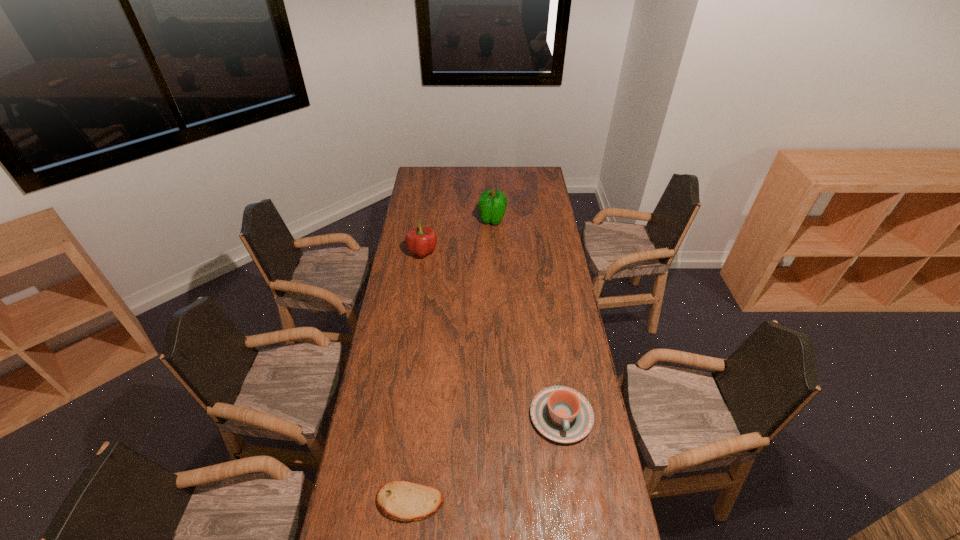
You are a GUI agent. You are given a task and a screenshot of the screen. Output one action in this format:
    pyautogui.click(x=<x>, y=<y>)
    Task: Click on the tallest object
    The image size is (960, 540).
    Given the screenshot: What is the action you would take?
    tap(492, 204)

This screenshot has height=540, width=960. In order to click on the farthest object in this screenshot , I will do `click(492, 204)`.

What are the coordinates of `the shorter bell pepper` in the screenshot? It's located at (420, 241).

The width and height of the screenshot is (960, 540). Identify the location of the left bell pepper. (420, 241).

Image resolution: width=960 pixels, height=540 pixels. Identify the location of chinaware. (562, 414).

Where is `the second shortest object`? Image resolution: width=960 pixels, height=540 pixels. the second shortest object is located at coordinates (562, 414).

In order to click on the shortest object in this screenshot , I will do `click(405, 501)`.

Locate an element on the screen. The width and height of the screenshot is (960, 540). the nearest object is located at coordinates (405, 501).

Where is `vacant space situated 0.250m on the left of the third object from left to right`? The width and height of the screenshot is (960, 540). vacant space situated 0.250m on the left of the third object from left to right is located at coordinates (431, 220).

At what (x,y) coordinates should I click in order to perform the action: click on free space located 0.360m on the back of the shorter bell pepper. Please return your answer as a coordinate pair (x, y). The image size is (960, 540). Looking at the image, I should click on (430, 202).